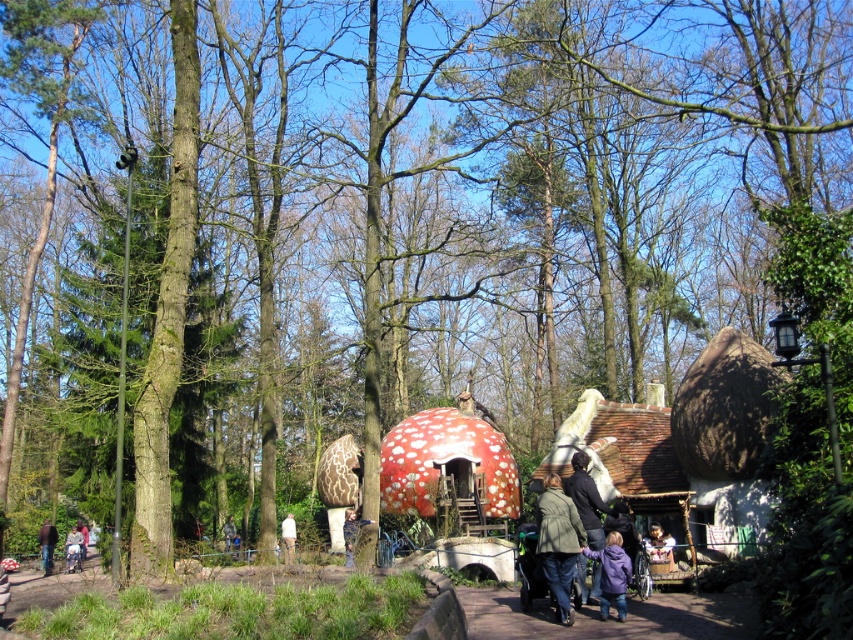
Consider the image. You are trying to decide which clothing item to wear for a hike. You have a dark blue jacket at center and a white cotton shirt at center. Which one is narrower?

The dark blue jacket at center is narrower than the white cotton shirt at center.